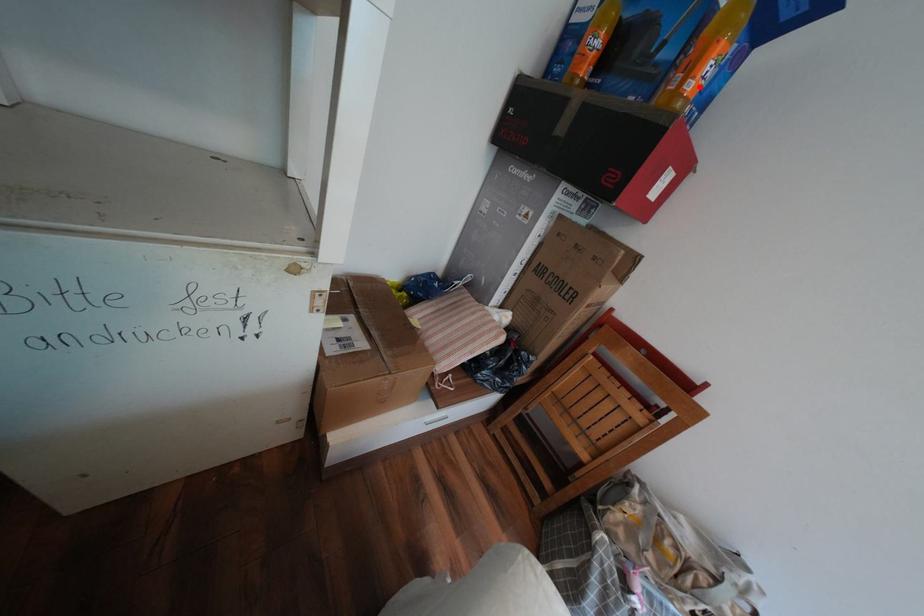
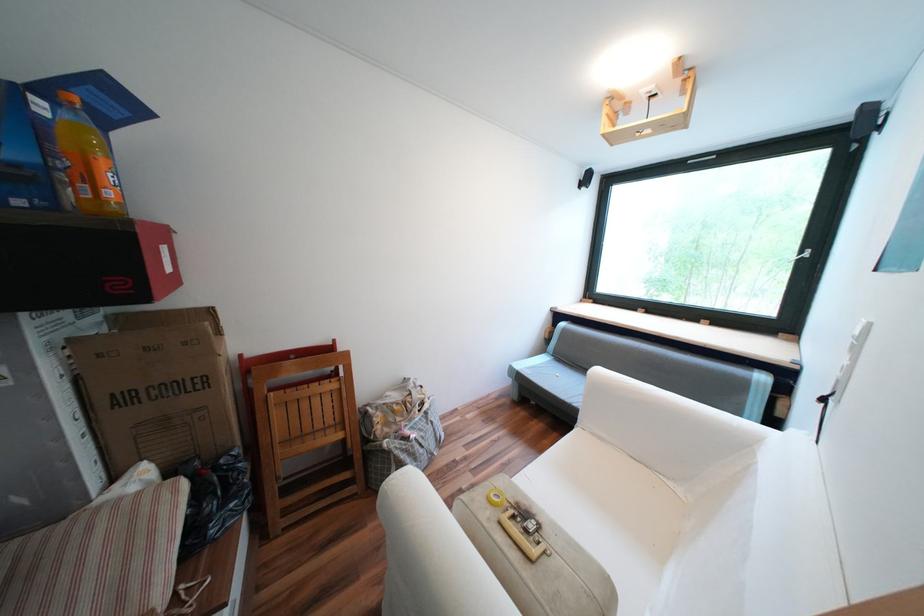
In the second image, find the point that corresponds to the highlighted location in the first image.

(118, 193)